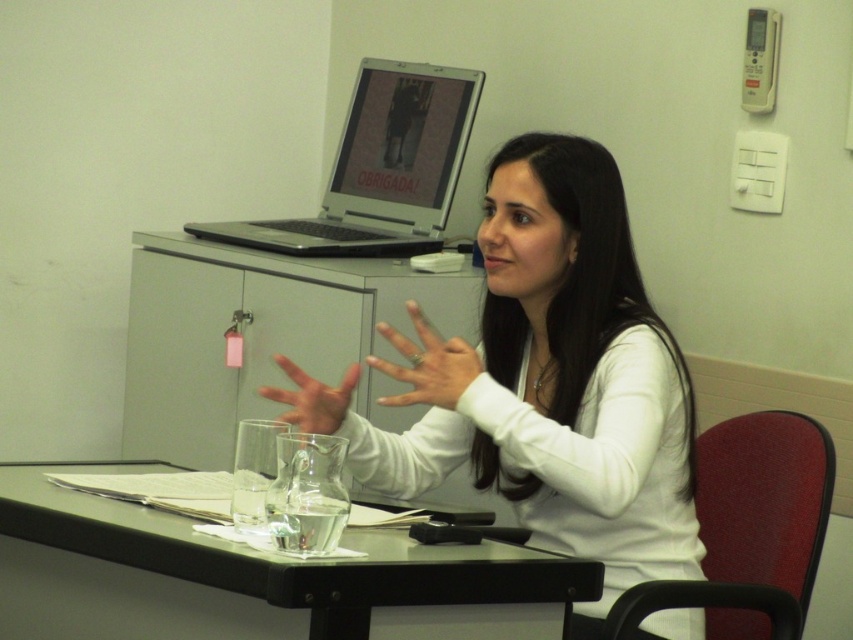
Is white matte hand at center bigger than translucent glass hand at center?

Yes.

Does white matte hand at center come in front of translucent glass hand at center?

No, white matte hand at center is behind translucent glass hand at center.

Who is more forward, (437, 348) or (279, 362)?

Positioned in front is point (279, 362).

Identify the location of white matte hand at center. This screenshot has width=853, height=640. (427, 364).

Is white matte shirt at center further to camera compared to silver metallic laptop at upper center?

No.

Which is more to the left, white matte shirt at center or silver metallic laptop at upper center?

silver metallic laptop at upper center is more to the left.

You are a GUI agent. You are given a task and a screenshot of the screen. Output one action in this format:
    pyautogui.click(x=<x>, y=<y>)
    Task: Click on the white matte shirt at center
    
    Given the screenshot: What is the action you would take?
    pyautogui.click(x=554, y=380)

What are the coordinates of `white matte shirt at center` in the screenshot? It's located at (554, 380).

Between silver metallic laptop at upper center and translucent glass hand at center, which one has less height?

With less height is translucent glass hand at center.

Between silver metallic laptop at upper center and translucent glass hand at center, which one appears on the right side from the viewer's perspective?

translucent glass hand at center is more to the right.

Where is `silver metallic laptop at upper center`? The image size is (853, 640). silver metallic laptop at upper center is located at coordinates (380, 170).